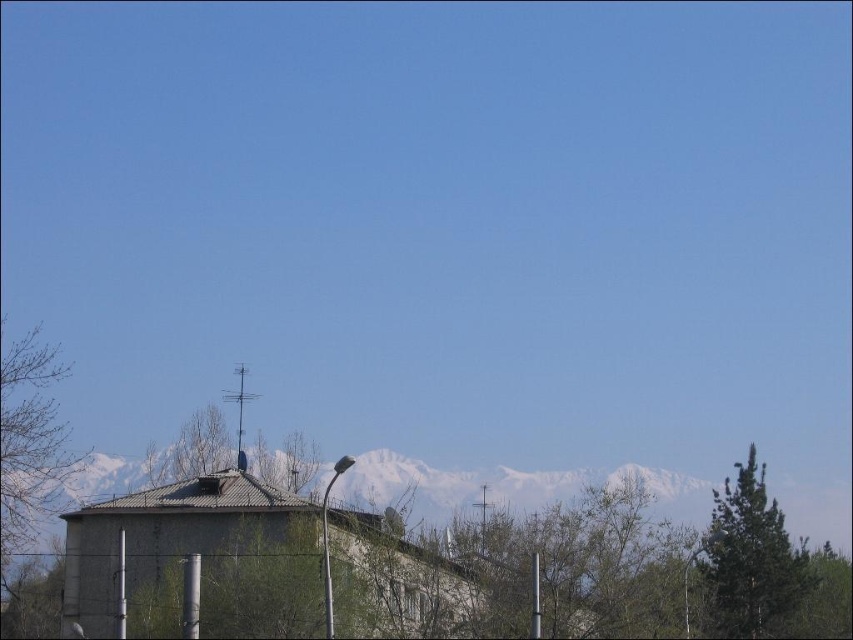
Question: Can you confirm if green textured tree at right is positioned below bare branches at left?

Choices:
 (A) yes
 (B) no

Answer: (A)

Question: Among these points, which one is farthest from the camera?

Choices:
 (A) (3, 332)
 (B) (721, 515)

Answer: (B)

Question: Does green textured tree at right come behind bare branches at left?

Choices:
 (A) yes
 (B) no

Answer: (A)

Question: Which object is closer to the camera taking this photo?

Choices:
 (A) bare branches at left
 (B) green textured tree at right

Answer: (A)

Question: Which of the following is the farthest from the observer?

Choices:
 (A) (44, 422)
 (B) (747, 476)

Answer: (B)

Question: Is green textured tree at right positioned before bare branches at left?

Choices:
 (A) yes
 (B) no

Answer: (B)